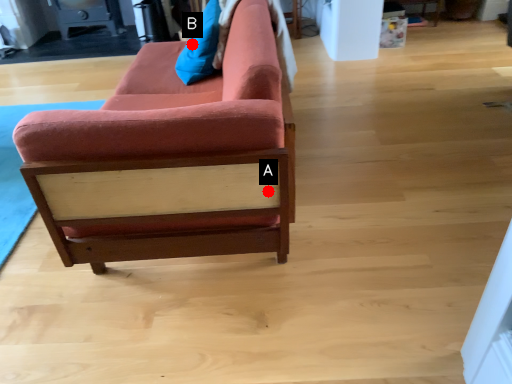
Question: Two points are circled on the image, labeled by A and B beside each circle. Which point is closer to the camera?

Choices:
 (A) A is closer
 (B) B is closer

Answer: (A)